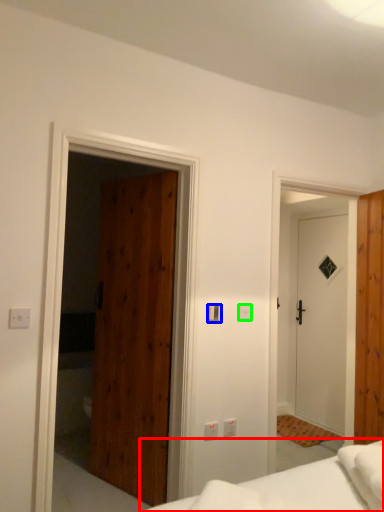
Question: Which is nearer to the bed (highlighted by a red box)? light switch (highlighted by a blue box) or light switch (highlighted by a green box).

Choices:
 (A) light switch
 (B) light switch

Answer: (A)